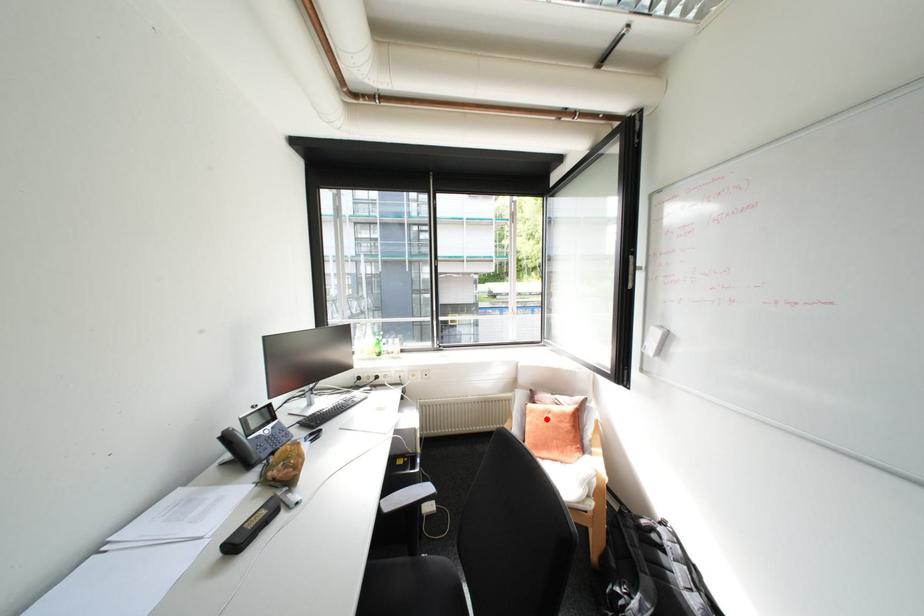
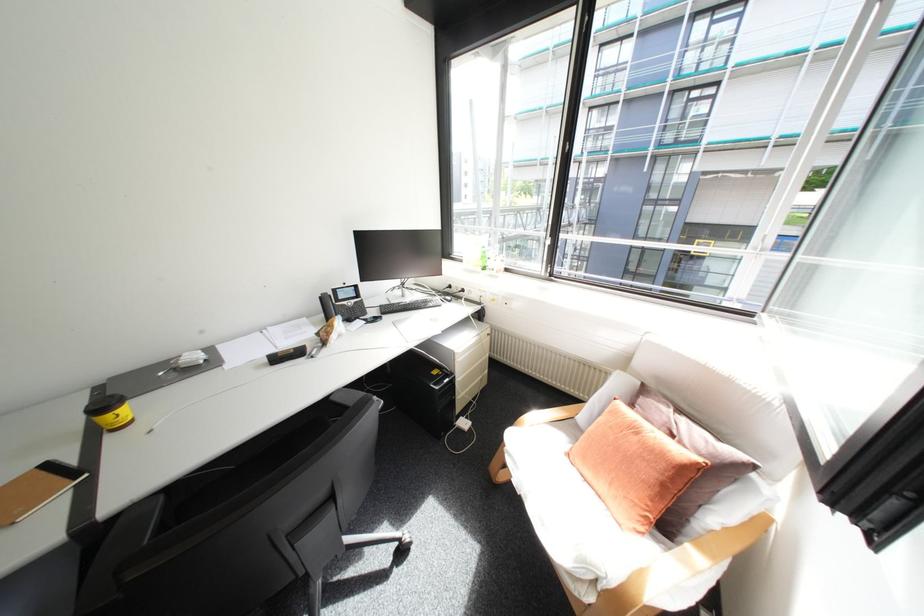
Locate, in the second image, the point that corresponds to the highlighted location in the first image.

(621, 428)